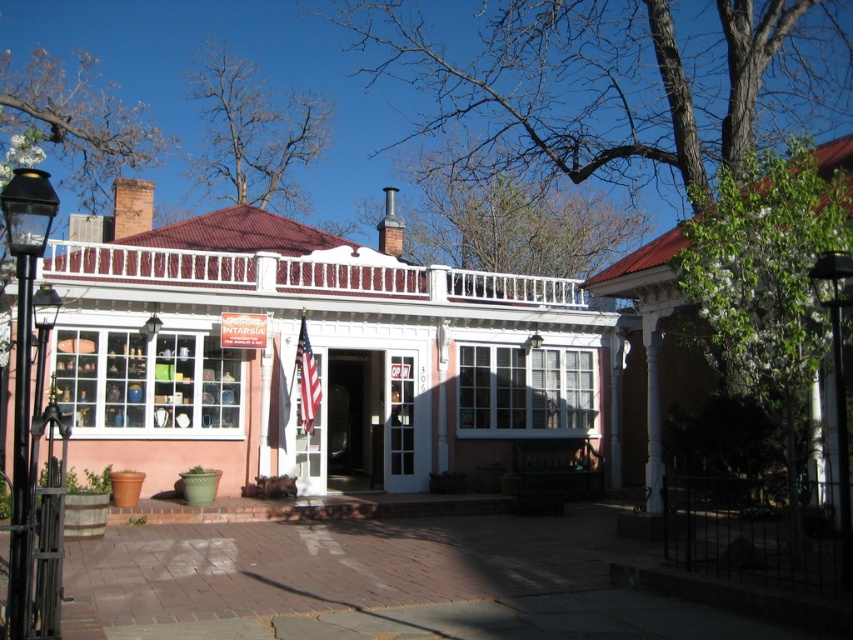
Is white painted wood porch at center shorter than matte white door at center?

Correct, white painted wood porch at center is not as tall as matte white door at center.

Is white painted wood porch at center positioned before matte white door at center?

That is True.

You are a GUI agent. You are given a task and a screenshot of the screen. Output one action in this format:
    pyautogui.click(x=<x>, y=<y>)
    Task: Click on the white painted wood porch at center
    
    Given the screenshot: What is the action you would take?
    pyautogui.click(x=306, y=275)

Is white painted wood porch at center positioned at the back of black metal lamp post at left?

Yes.

Between point (440, 282) and point (41, 179), which one is positioned in front?

Point (41, 179) is in front.

Which is behind, point (149, 278) or point (9, 593)?

The point (149, 278) is behind.

Image resolution: width=853 pixels, height=640 pixels. Identify the location of white painted wood porch at center. (306, 275).

Is point (13, 428) farther from viewer compared to point (372, 422)?

No, (13, 428) is closer to viewer.

Does point (25, 324) lie in front of point (381, 442)?

Yes, point (25, 324) is closer to viewer.

The width and height of the screenshot is (853, 640). Find the location of `black metal lamp post at left`. black metal lamp post at left is located at coordinates (22, 371).